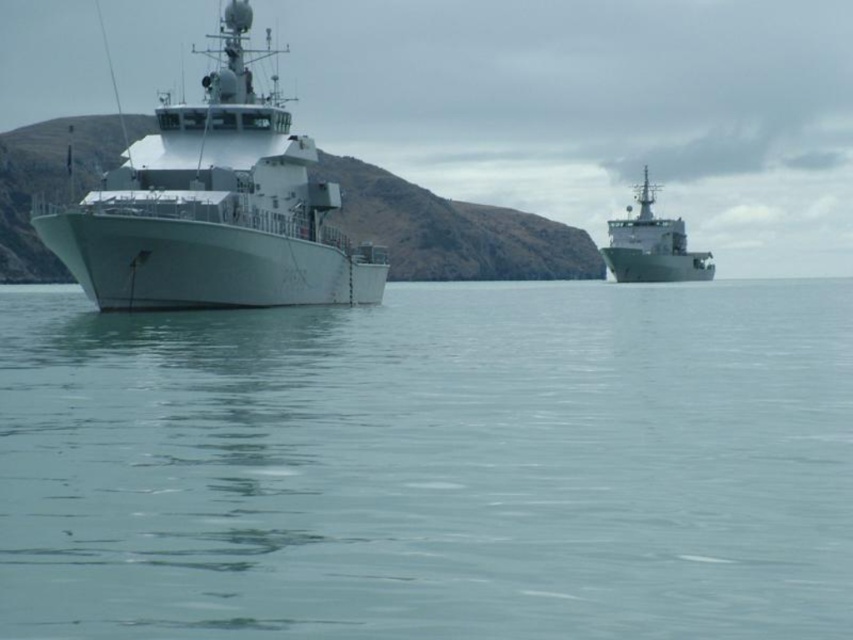
Question: Where is clear blue water at center located in relation to metallic gray ship at upper right in the image?

Choices:
 (A) below
 (B) above

Answer: (A)

Question: Which object appears closest to the camera in this image?

Choices:
 (A) metallic gray ship at upper right
 (B) white matte ship at left
 (C) clear blue water at center

Answer: (C)

Question: Which point appears farthest from the camera in this image?

Choices:
 (A) (410, 426)
 (B) (657, 248)
 (C) (279, 276)

Answer: (B)

Question: Does white matte ship at left appear on the right side of metallic gray ship at upper right?

Choices:
 (A) yes
 (B) no

Answer: (B)

Question: Considering the real-world distances, which object is farthest from the metallic gray ship at upper right?

Choices:
 (A) white matte ship at left
 (B) clear blue water at center

Answer: (A)

Question: Is clear blue water at center thinner than metallic gray ship at upper right?

Choices:
 (A) yes
 (B) no

Answer: (B)